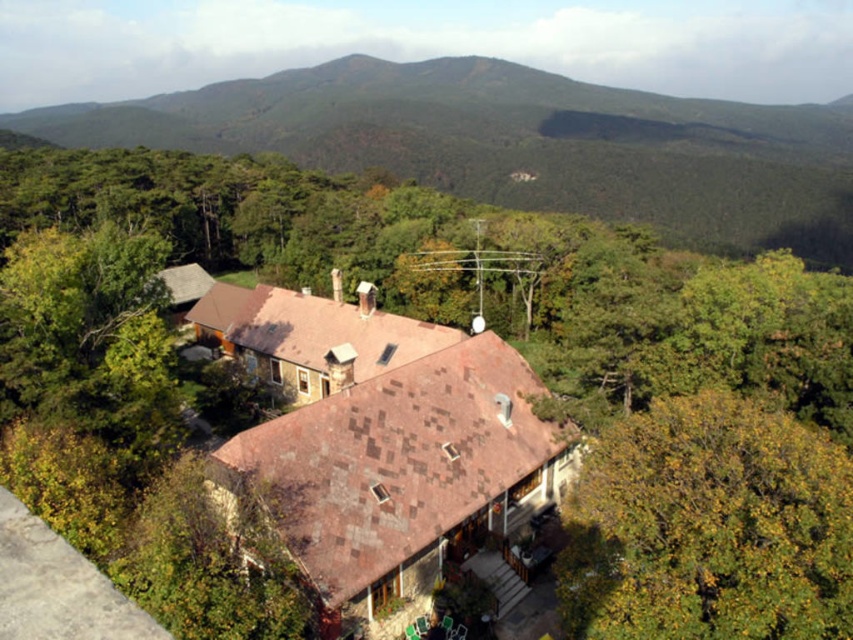
Question: Does green forested mountain at upper center appear under yellow-green foliage at lower right?

Choices:
 (A) yes
 (B) no

Answer: (B)

Question: Can you confirm if green forested mountain at upper center is smaller than yellow-green foliage at lower right?

Choices:
 (A) no
 (B) yes

Answer: (A)

Question: Which point is closer to the camera taking this photo?

Choices:
 (A) (456, 60)
 (B) (730, 444)

Answer: (B)

Question: In this image, where is green forested mountain at upper center located relative to yellow-green foliage at lower right?

Choices:
 (A) right
 (B) left

Answer: (A)